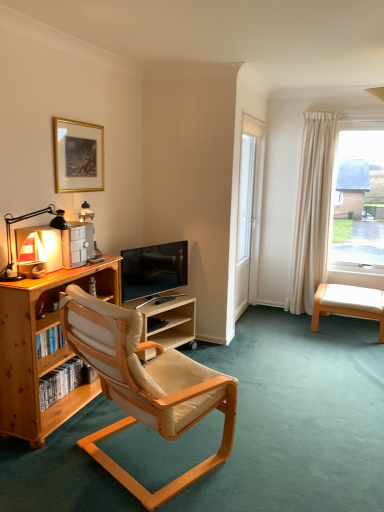
Locate an element on the screen. This screenshot has width=384, height=512. wooden bookcase at left is located at coordinates (36, 350).

The height and width of the screenshot is (512, 384). What do you see at coordinates (349, 304) in the screenshot?
I see `beige leather swivel chair at lower right` at bounding box center [349, 304].

What is the approximate height of gold metallic picture frame at upper left?

It is 19.50 inches.

Image resolution: width=384 pixels, height=512 pixels. I want to click on gold metallic picture frame at upper left, so click(x=78, y=156).

Find the location of a particular element. Image resolution: width=384 pixels, height=512 pixels. wooden bookcase at left is located at coordinates (36, 350).

Looking at their sizes, would you say beige leather chair at center is wider or thinner than matte black tv at center?

Considering their sizes, beige leather chair at center looks broader than matte black tv at center.

From the picture: From the image's perspective, is beige leather chair at center on top of matte black tv at center?

Incorrect, from the image's perspective, beige leather chair at center is lower than matte black tv at center.

Can you confirm if beige leather chair at center is smaller than matte black tv at center?

Actually, beige leather chair at center might be larger than matte black tv at center.

Measure the distance between beige leather chair at center and matte black tv at center.

beige leather chair at center is 1.08 meters away from matte black tv at center.

Could you tell me if gold metallic picture frame at upper left is turned towards matte black tv at center?

No, gold metallic picture frame at upper left does not turn towards matte black tv at center.

Locate an element on the screen. The image size is (384, 512). picture frame above the matte black tv at center (from a real-world perspective) is located at coordinates (78, 156).

Which point is more distant from viewer, (97,173) or (122,267)?

The point (122,267) is more distant.

In the scene shown: From the image's perspective, is gold metallic picture frame at upper left on top of matte black tv at center?

Indeed, from the image's perspective, gold metallic picture frame at upper left is shown above matte black tv at center.

From the image's perspective, between light wood/woodenobject at center and white glass screen door at center, who is located below?

light wood/woodenobject at center is shown below in the image.

Can you tell me how much light wood/woodenobject at center and white glass screen door at center differ in facing direction?

They differ by 20.7 degrees in their facing directions.

Considering the sizes of objects light wood/woodenobject at center and white glass screen door at center in the image provided, who is thinner, light wood/woodenobject at center or white glass screen door at center?

white glass screen door at center.

Is point (173, 320) positioned in front of point (263, 145)?

Yes, point (173, 320) is in front of point (263, 145).

I want to click on bookcase that is below the matte black desk lamp at left (from the image's perspective), so click(36, 350).

Which is in front, matte black desk lamp at left or wooden bookcase at left?

matte black desk lamp at left is more forward.

Can you confirm if matte black desk lamp at left is taller than wooden bookcase at left?

Incorrect, the height of matte black desk lamp at left is not larger of that of wooden bookcase at left.

Can you confirm if gold metallic picture frame at upper left is bigger than matte black desk lamp at left?

Incorrect, gold metallic picture frame at upper left is not larger than matte black desk lamp at left.

Can we say gold metallic picture frame at upper left lies outside matte black desk lamp at left?

That's correct, gold metallic picture frame at upper left is outside of matte black desk lamp at left.

Find the location of a particular element. The image size is (384, 512). lamp on the left of gold metallic picture frame at upper left is located at coordinates (27, 218).

Is beige leather swivel chair at lower right smaller than matte black tv at center?

Incorrect, beige leather swivel chair at lower right is not smaller in size than matte black tv at center.

Can you confirm if beige leather swivel chair at lower right is thinner than matte black tv at center?

In fact, beige leather swivel chair at lower right might be wider than matte black tv at center.

Measure the distance between beige leather swivel chair at lower right and matte black tv at center.

beige leather swivel chair at lower right and matte black tv at center are 1.63 meters apart.

Based on the photo, can you confirm if beige leather swivel chair at lower right is positioned to the left of matte black tv at center?

No, beige leather swivel chair at lower right is not to the left of matte black tv at center.

From the image's perspective, does wooden bookcase at left appear lower than matte black desk lamp at left?

Yes, from the image's perspective, wooden bookcase at left is below matte black desk lamp at left.

Can you confirm if wooden bookcase at left is wider than matte black desk lamp at left?

Yes.

At what (x,y) coordinates should I click in order to perform the action: click on bookcase behind the matte black desk lamp at left. Please return your answer as a coordinate pair (x, y). Looking at the image, I should click on (36, 350).

Is wooden bookcase at left oriented away from matte black desk lamp at left?

wooden bookcase at left does not have its back to matte black desk lamp at left.

Identify the location of television that is above the beige leather chair at center (from the image's perspective). Image resolution: width=384 pixels, height=512 pixels. (153, 269).

In order to click on picture frame on the left of matte black tv at center in this screenshot , I will do (78, 156).

Looking at the image, which one is located further to beige leather swivel chair at lower right, beige leather chair at center or white glass screen door at center?

beige leather chair at center is further to beige leather swivel chair at lower right.

From the image, which object appears to be farther from gold metallic picture frame at upper left, light wood/woodenobject at center or matte black desk lamp at left?

light wood/woodenobject at center lies further to gold metallic picture frame at upper left than the other object.

Which object lies further to the anchor point beige leather chair at center, beige leather swivel chair at lower right or matte black desk lamp at left?

beige leather swivel chair at lower right is further to beige leather chair at center.

Which object lies nearer to the anchor point beige leather chair at center, beige leather swivel chair at lower right or matte black tv at center?

matte black tv at center is closer to beige leather chair at center.

Looking at the image, which one is located closer to beige leather chair at center, light wood/woodenobject at center or wooden bookcase at left?

wooden bookcase at left is positioned closer to the anchor beige leather chair at center.

When comparing their distances from beige leather chair at center, does matte black desk lamp at left or wooden bookcase at left seem further?

matte black desk lamp at left.

Looking at the image, which one is located further to gold metallic picture frame at upper left, light wood/woodenobject at center or wooden bookcase at left?

The object further to gold metallic picture frame at upper left is light wood/woodenobject at center.

Estimate the real-world distances between objects in this image. Which object is closer to wooden bookcase at left, white glass screen door at center or light wood/woodenobject at center?

light wood/woodenobject at center is positioned closer to the anchor wooden bookcase at left.

The image size is (384, 512). Find the location of `shelf positioned between matte black desk lamp at left and white glass screen door at center from near to far`. shelf positioned between matte black desk lamp at left and white glass screen door at center from near to far is located at coordinates (170, 322).

At what (x,y) coordinates should I click in order to perform the action: click on television between beige leather chair at center and white glass screen door at center from front to back. Please return your answer as a coordinate pair (x, y). Image resolution: width=384 pixels, height=512 pixels. Looking at the image, I should click on (153, 269).

At what (x,y) coordinates should I click in order to perform the action: click on lamp positioned between beige leather chair at center and light wood/woodenobject at center from near to far. Please return your answer as a coordinate pair (x, y). Looking at the image, I should click on (27, 218).

Where is `chair between wooden bookcase at left and beige leather swivel chair at lower right`? The image size is (384, 512). chair between wooden bookcase at left and beige leather swivel chair at lower right is located at coordinates (145, 386).